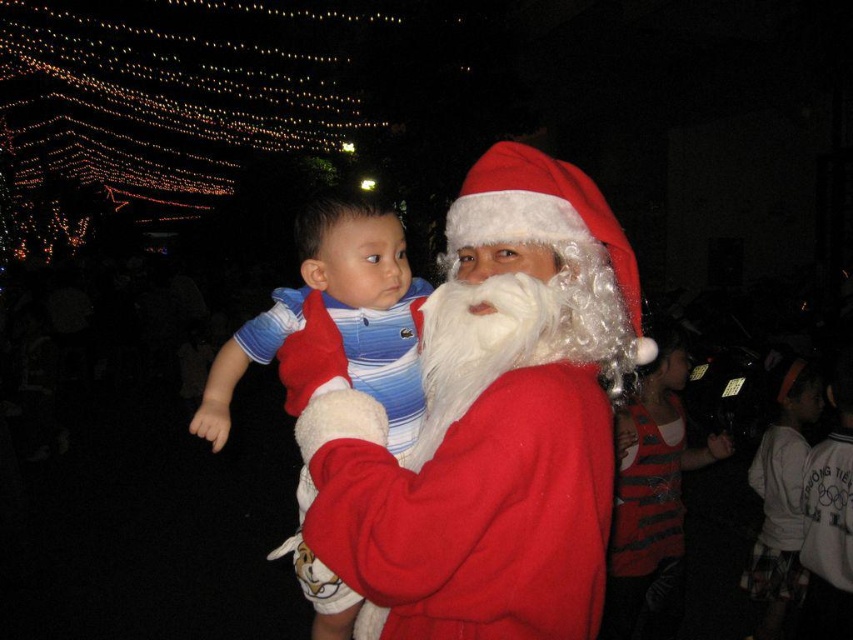
You are planning to take a photo of the red velvet santa at center and the blue striped shirt at center. The camera frame can only fit objects that are not wider than 1.2 meters combined. Can both objects fit in the frame together?

The red velvet santa at center might be wider than blue striped shirt at center, but since the combined width is not specified, it is uncertain if they can fit in the frame together.

You are a photographer who wants to capture a photo of the red velvet santa at center and the blue striped shirt at center. From the perspective of the camera, which object is located to the left?

The blue striped shirt at center is located to the left of the red velvet santa at center because the red velvet santa at center is positioned on the right side of blue striped shirt at center.